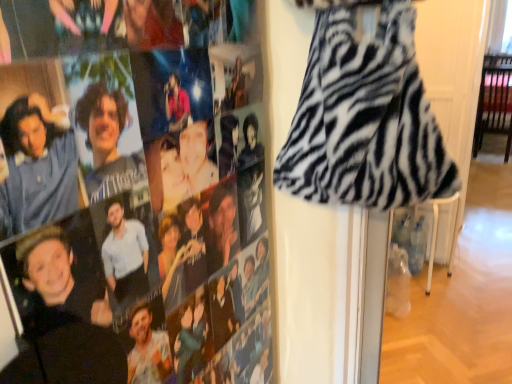
Question: From a real-world perspective, is zebra print fur dress at right above or below zebra print dress at right?

Choices:
 (A) above
 (B) below

Answer: (A)

Question: Based on their positions, is zebra print fur dress at right located to the left or right of zebra print dress at right?

Choices:
 (A) right
 (B) left

Answer: (A)

Question: Considering the positions of zebra print fur dress at right and zebra print dress at right in the image, is zebra print fur dress at right bigger or smaller than zebra print dress at right?

Choices:
 (A) big
 (B) small

Answer: (A)

Question: In the image, is zebra print dress at right positioned in front of or behind zebra print fur dress at right?

Choices:
 (A) front
 (B) behind

Answer: (A)

Question: Based on their sizes in the image, would you say zebra print dress at right is bigger or smaller than zebra print fur dress at right?

Choices:
 (A) small
 (B) big

Answer: (A)

Question: Looking at their shapes, would you say zebra print dress at right is wider or thinner than zebra print fur dress at right?

Choices:
 (A) wide
 (B) thin

Answer: (B)

Question: Is point (245, 218) positioned closer to the camera than point (362, 158)?

Choices:
 (A) farther
 (B) closer

Answer: (A)